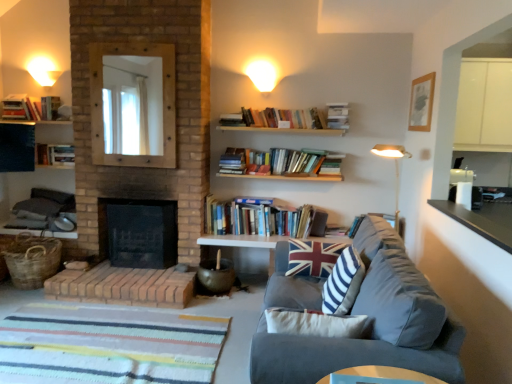
Locate an element on the screen. This screenshot has height=384, width=512. free space above white matte wall sconce at upper left, which ranks as the second lighting in right-to-left order (from a real-world perspective) is located at coordinates (42, 69).